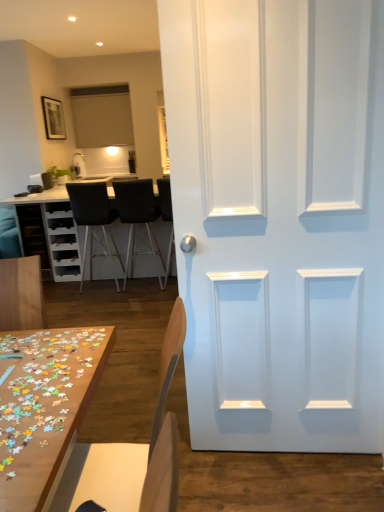
Question: Considering the relative positions of matte black cabinet at left and white matte door at center in the image provided, is matte black cabinet at left to the left or to the right of white matte door at center?

Choices:
 (A) left
 (B) right

Answer: (A)

Question: Choose the correct answer: Is matte black cabinet at left inside white matte door at center or outside it?

Choices:
 (A) outside
 (B) inside

Answer: (A)

Question: Which object is the closest to the wooden puzzle pieces at lower left, acting as the second table starting from the back?

Choices:
 (A) black leather chair at center, acting as the 1th chair starting from the back
 (B) matte black cabinet at left
 (C) black leather chair at center, the 2th chair when ordered from front to back
 (D) light brown wood chair at lower center, which is counted as the 4th chair, starting from the back
 (E) white matte door at center

Answer: (D)

Question: Which object is the farthest from the black leather chair at center, marked as the 4th chair in a front-to-back arrangement?

Choices:
 (A) wooden puzzle pieces at lower left, arranged as the first table when viewed from the front
 (B) black leather chair at center, the 2th chair when ordered from front to back
 (C) white glossy table at upper left, which is the second table from front to back
 (D) black fabric chair at center, acting as the second chair starting from the back
 (E) matte black cabinet at left

Answer: (A)